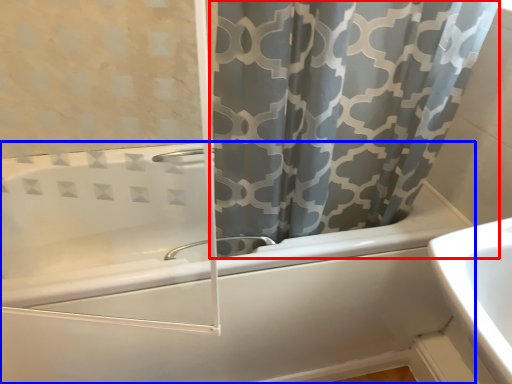
Question: Which of the following is the farthest to the observer, curtain (highlighted by a red box) or bathtub (highlighted by a blue box)?

Choices:
 (A) curtain
 (B) bathtub

Answer: (B)